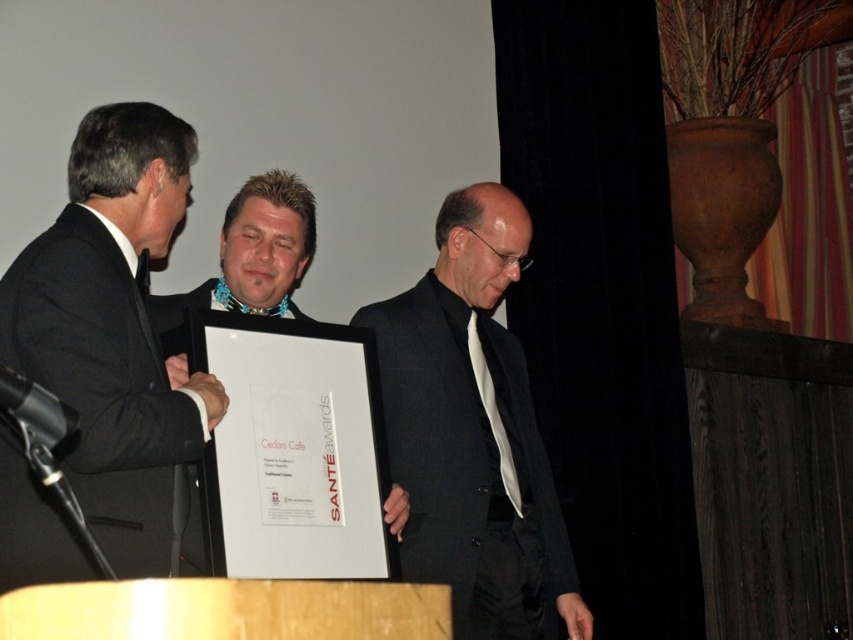
You are attending an awards ceremony and notice two items of interest in the scene described. The first is the matte black suit at center, and the second is the matte black frame at center. Based on their positions, which item is closer to your right side?

The matte black suit at center is to the right of the matte black frame at center, so the matte black suit at center is closer to your right side.

You are organizing a photo shoot and need to ensure that all participants are visible in the frame. Given that the black suit at left and the matte black frame at center are both in the shot, which object should be positioned closer to the camera to ensure both are clearly visible?

The black suit at left should be positioned closer to the camera since it is larger in size than the matte black frame at center, ensuring both objects appear appropriately sized in the photo.

You are a photographer at the event and need to adjust the lighting so that both the black suit at left and the matte black suit at center are evenly illuminated. Since they are positioned differently, which one is closer to the camera and might need less light adjustment?

The black suit at left is in front of matte black suit at center, so it is closer to the camera and requires less light adjustment.